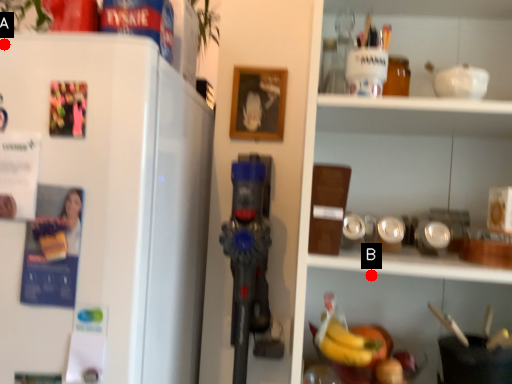
Question: Two points are circled on the image, labeled by A and B beside each circle. Which point is closer to the camera?

Choices:
 (A) A is closer
 (B) B is closer

Answer: (A)